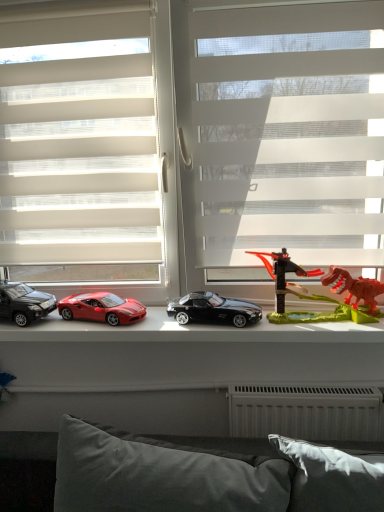
Question: From the image's perspective, is shiny black car at left, placed as the 1th car when sorted from left to right, above white sheer blinds at center, which appears as the 1th window when viewed from the left?

Choices:
 (A) yes
 (B) no

Answer: (B)

Question: From a real-world perspective, is shiny black car at left, placed as the 1th car when sorted from left to right, under white sheer blinds at center, which appears as the 1th window when viewed from the left?

Choices:
 (A) no
 (B) yes

Answer: (B)

Question: Is white sheer blinds at center, which is the second window from right to left, completely or partially inside shiny black car at left, placed as the 3th car when sorted from right to left?

Choices:
 (A) no
 (B) yes

Answer: (A)

Question: Is shiny black car at left, placed as the 1th car when sorted from left to right, completely or partially outside of white sheer blinds at center, which appears as the 1th window when viewed from the left?

Choices:
 (A) yes
 (B) no

Answer: (A)

Question: Does shiny black car at left, placed as the 1th car when sorted from left to right, have a larger size compared to white sheer blinds at center, which is the second window from right to left?

Choices:
 (A) yes
 (B) no

Answer: (B)

Question: Is shiny plastic toy cars at center inside the boundaries of transparent plastic dinosaur at right, or outside?

Choices:
 (A) outside
 (B) inside

Answer: (A)

Question: From the image's perspective, is shiny plastic toy cars at center located above or below transparent plastic dinosaur at right?

Choices:
 (A) above
 (B) below

Answer: (B)

Question: Relative to transparent plastic dinosaur at right, is shiny plastic toy cars at center in front or behind?

Choices:
 (A) behind
 (B) front

Answer: (A)

Question: Considering the positions of shiny plastic toy cars at center and transparent plastic dinosaur at right in the image, is shiny plastic toy cars at center bigger or smaller than transparent plastic dinosaur at right?

Choices:
 (A) small
 (B) big

Answer: (A)

Question: Considering the relative positions of shiny black car at left, placed as the 3th car when sorted from right to left, and white translucent blinds at center, the first window positioned from the right, in the image provided, is shiny black car at left, placed as the 3th car when sorted from right to left, to the left or to the right of white translucent blinds at center, the first window positioned from the right,?

Choices:
 (A) right
 (B) left

Answer: (B)

Question: Is shiny black car at left, placed as the 1th car when sorted from left to right, spatially inside white translucent blinds at center, the first window positioned from the right, or outside of it?

Choices:
 (A) inside
 (B) outside

Answer: (A)

Question: From a real-world perspective, is shiny black car at left, placed as the 3th car when sorted from right to left, positioned above or below white translucent blinds at center, the first window positioned from the right?

Choices:
 (A) above
 (B) below

Answer: (B)

Question: Is shiny black car at left, placed as the 3th car when sorted from right to left, bigger or smaller than white translucent blinds at center, the first window positioned from the right?

Choices:
 (A) big
 (B) small

Answer: (B)

Question: From the image's perspective, is black metallic car at center, the first car from the right, located above or below translucent plastic dinosaur at right?

Choices:
 (A) above
 (B) below

Answer: (B)

Question: Is point click(x=211, y=307) closer or farther from the camera than point click(x=284, y=313)?

Choices:
 (A) farther
 (B) closer

Answer: (B)